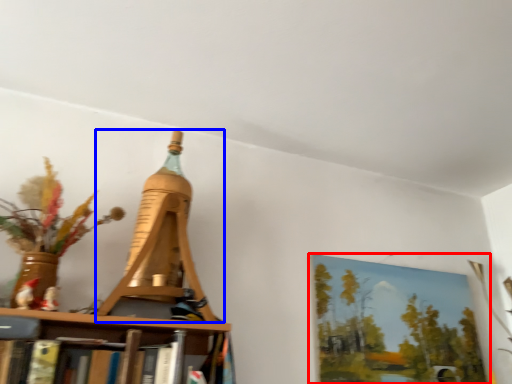
Question: Which point is further to the camera, picture frame (highlighted by a red box) or Eiffel tower (highlighted by a blue box)?

Choices:
 (A) picture frame
 (B) Eiffel tower

Answer: (A)